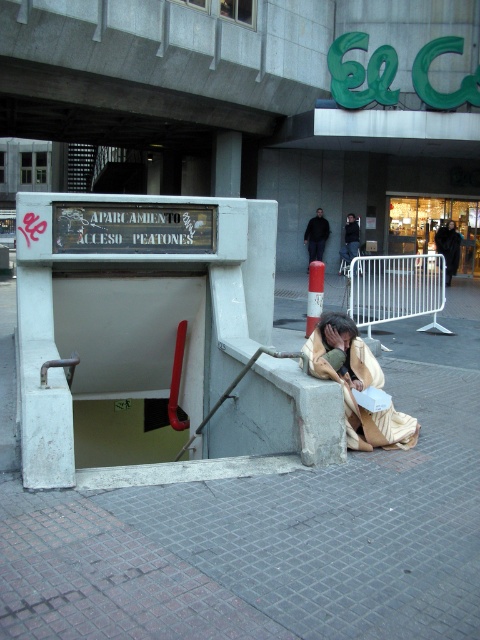
Question: Which point is farther to the camera?

Choices:
 (A) (357, 243)
 (B) (314, 221)

Answer: (B)

Question: Which of the following is the closest to the observer?

Choices:
 (A) black fabric bag at lower right
 (B) beige fabric blanket at lower center

Answer: (B)

Question: Is black fabric bag at lower right positioned behind dark brown leather jacket at center?

Choices:
 (A) no
 (B) yes

Answer: (A)

Question: In this image, where is black fabric bag at lower right located relative to dark blue jeans at center?

Choices:
 (A) below
 (B) above

Answer: (A)

Question: Does beige fabric blanket at lower center appear on the right side of dark brown leather jacket at center?

Choices:
 (A) yes
 (B) no

Answer: (B)

Question: Which object appears closest to the camera in this image?

Choices:
 (A) gray concrete pavement at lower center
 (B) gray concrete curb at lower center
 (C) dark brown leather jacket at center

Answer: (A)